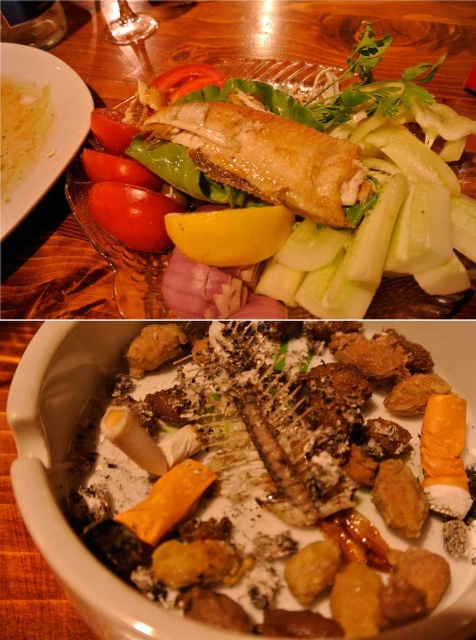
Is point (9, 164) in front of point (194, 234)?

No.

Where is `matte brown plate at upper left`? matte brown plate at upper left is located at coordinates (36, 125).

Can you confirm if crumbly golden bread at center is positioned to the right of yellow matte lemon at center?

Yes, crumbly golden bread at center is to the right of yellow matte lemon at center.

Is the position of crumbly golden bread at center more distant than that of yellow matte lemon at center?

No, crumbly golden bread at center is in front of yellow matte lemon at center.

The width and height of the screenshot is (476, 640). Describe the element at coordinates (267, 484) in the screenshot. I see `crumbly golden bread at center` at that location.

Where is `crumbly golden bread at center`? This screenshot has width=476, height=640. crumbly golden bread at center is located at coordinates (267, 484).

Does crumbly golden bread at center appear on the right side of golden crispy fish at center?

Yes, crumbly golden bread at center is to the right of golden crispy fish at center.

Looking at this image, between crumbly golden bread at center and golden crispy fish at center, which one appears on the right side from the viewer's perspective?

crumbly golden bread at center is more to the right.

Is point (240, 332) in front of point (383, 308)?

Yes.

In order to click on crumbly golden bread at center in this screenshot , I will do `click(267, 484)`.